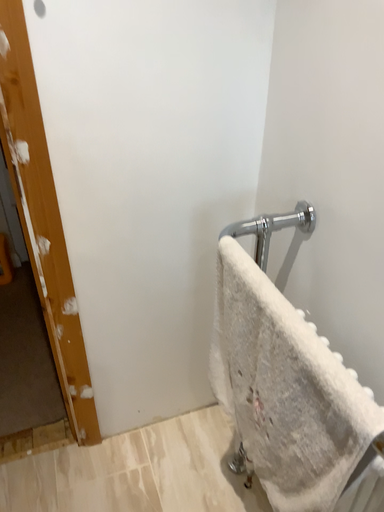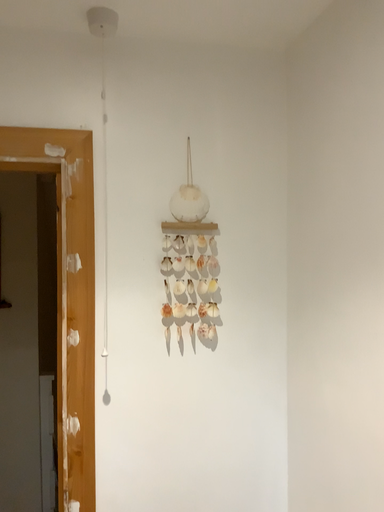
Question: Which way did the camera rotate in the video?

Choices:
 (A) rotated downward
 (B) rotated upward

Answer: (B)